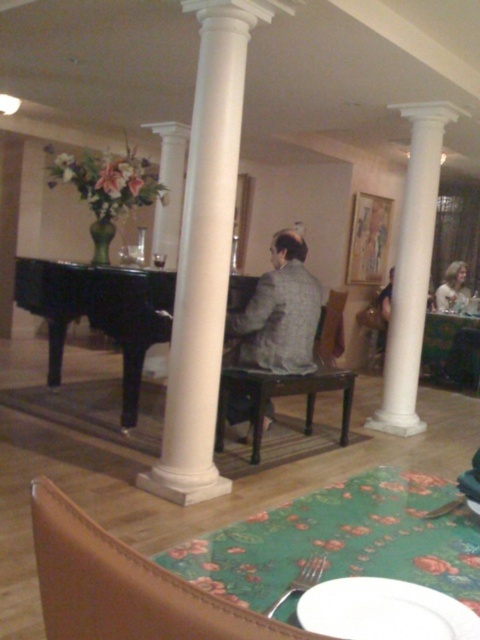
Does white smooth column at center have a larger size compared to black polished piano at center?

Actually, white smooth column at center might be smaller than black polished piano at center.

Find the location of a particular element. Image resolution: width=480 pixels, height=640 pixels. white smooth column at center is located at coordinates (205, 250).

Measure the distance between white smooth column at center and camera.

white smooth column at center is 2.75 meters away from camera.

Between white smooth column at center and green fabric table at lower right, which one has less height?

green fabric table at lower right

Identify the location of white smooth column at center. (205, 250).

Looking at this image, does black polished piano at center appear on the left side of blonde hair at upper right?

Indeed, black polished piano at center is positioned on the left side of blonde hair at upper right.

Which is more to the right, black polished piano at center or blonde hair at upper right?

blonde hair at upper right is more to the right.

The image size is (480, 640). Describe the element at coordinates (98, 312) in the screenshot. I see `black polished piano at center` at that location.

The height and width of the screenshot is (640, 480). What are the coordinates of `black polished piano at center` in the screenshot? It's located at (98, 312).